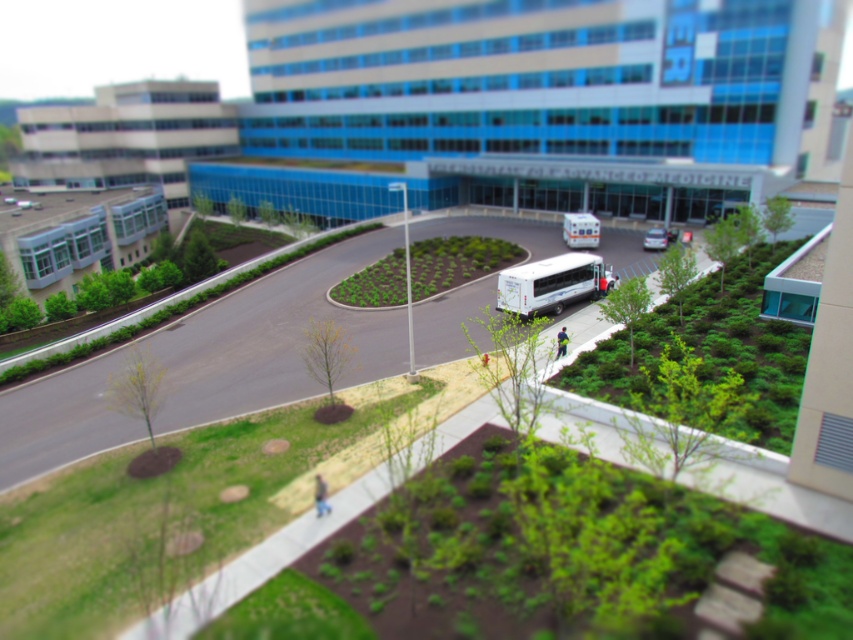
Can you confirm if white matte bus at center is positioned to the left of silver metallic van at center?

Indeed, white matte bus at center is positioned on the left side of silver metallic van at center.

Identify the location of white matte bus at center. The width and height of the screenshot is (853, 640). (549, 284).

Consider the image. Is white matte bus at center in front of white glossy bus at center?

Yes, it is in front of white glossy bus at center.

Does white matte bus at center have a lesser width compared to white glossy bus at center?

Incorrect, white matte bus at center's width is not less than white glossy bus at center's.

The width and height of the screenshot is (853, 640). What do you see at coordinates (549, 284) in the screenshot? I see `white matte bus at center` at bounding box center [549, 284].

Locate an element on the screen. Image resolution: width=853 pixels, height=640 pixels. white matte bus at center is located at coordinates (549, 284).

Is white glossy bus at center taller than silver metallic van at center?

Indeed, white glossy bus at center has a greater height compared to silver metallic van at center.

Measure the distance between white glossy bus at center and camera.

A distance of 53.70 meters exists between white glossy bus at center and camera.

Who is more distant from viewer, (566, 234) or (653, 244)?

Point (566, 234)

You are a GUI agent. You are given a task and a screenshot of the screen. Output one action in this format:
    pyautogui.click(x=<x>, y=<y>)
    Task: Click on the white glossy bus at center
    This screenshot has width=853, height=640.
    Given the screenshot: What is the action you would take?
    pyautogui.click(x=579, y=228)